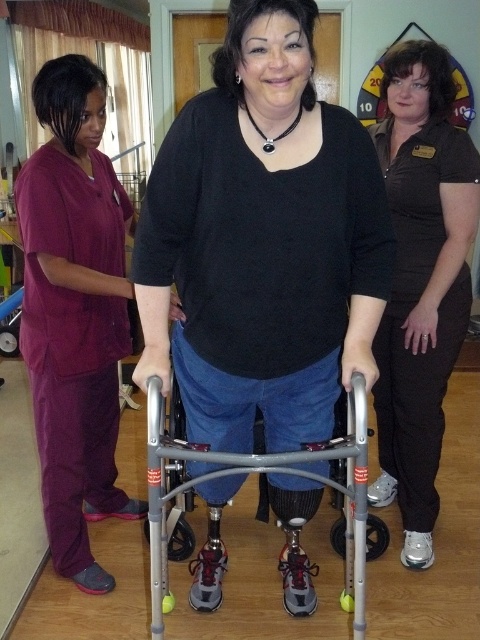
Is maroon scrubs at left bigger than black matte pants at center?

Indeed, maroon scrubs at left has a larger size compared to black matte pants at center.

Which is behind, point (40, 432) or point (416, 422)?

Point (416, 422)

Who is more forward, (61,120) or (419,234)?

Point (61,120) is in front.

Find the location of a particular element. The image size is (480, 640). maroon scrubs at left is located at coordinates (74, 312).

Is point (312, 403) closer to camera compared to point (99, 324)?

Yes, it is in front of point (99, 324).

How distant is black matte walker at center from maroon scrubs at left?

black matte walker at center and maroon scrubs at left are 23.08 inches apart from each other.

You are a GUI agent. You are given a task and a screenshot of the screen. Output one action in this format:
    pyautogui.click(x=<x>, y=<y>)
    Task: Click on the black matte walker at center
    
    Given the screenshot: What is the action you would take?
    point(263,241)

Identify the location of black matte walker at center. (263, 241).

Is black matte walker at center smaller than black matte pants at center?

No, black matte walker at center is not smaller than black matte pants at center.

Does black matte walker at center appear on the right side of black matte pants at center?

In fact, black matte walker at center is to the left of black matte pants at center.

Is point (313, 141) in front of point (421, 296)?

Yes, point (313, 141) is in front of point (421, 296).

Locate an element on the screen. black matte walker at center is located at coordinates (263, 241).